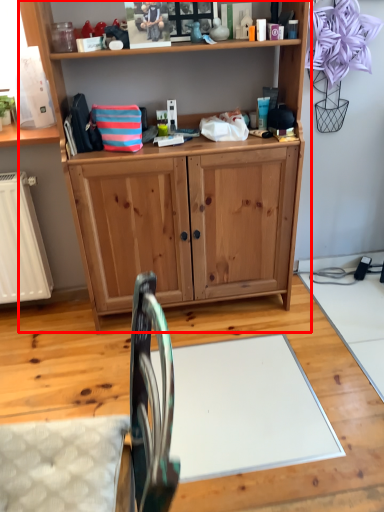
Question: Considering the relative positions of vanity (annotated by the red box) and swivel chair in the image provided, where is vanity (annotated by the red box) located with respect to the staircase?

Choices:
 (A) right
 (B) left

Answer: (A)